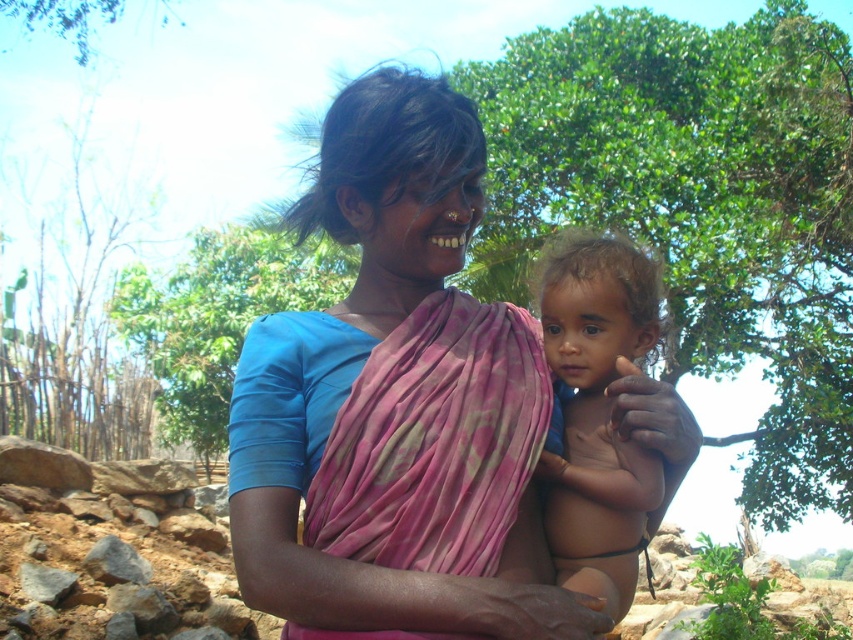
You are a photographer trying to capture a portrait of the smooth skin baby at center and the green leafy tree at center in the background. Can you position the baby so that the tree is clearly visible behind them?

Yes, since the smooth skin baby at center is in front of the green leafy tree at center, positioning the baby in front while ensuring the tree is within the camera frame will allow the tree to be visible behind them as the background.

What is located at the point with coordinates (393, 195) in the image?

The pink fabric at center is located at point (393, 195).